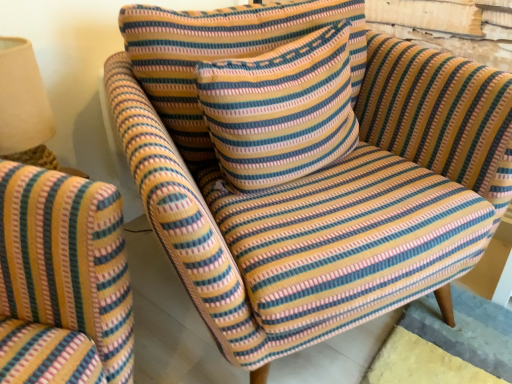
What do you see at coordinates (220, 54) in the screenshot? I see `striped fabric pillow at center` at bounding box center [220, 54].

Find the location of a particular element. striped fabric pillow at center is located at coordinates click(x=220, y=54).

Where is `striped fabric pillow at center`? striped fabric pillow at center is located at coordinates (220, 54).